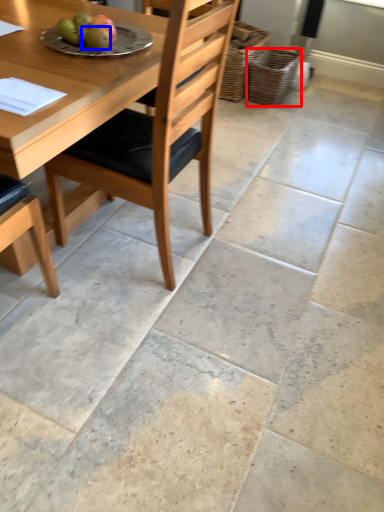
Question: Which object appears closest to the camera in this image, basket (highlighted by a red box) or fruit (highlighted by a blue box)?

Choices:
 (A) basket
 (B) fruit

Answer: (B)